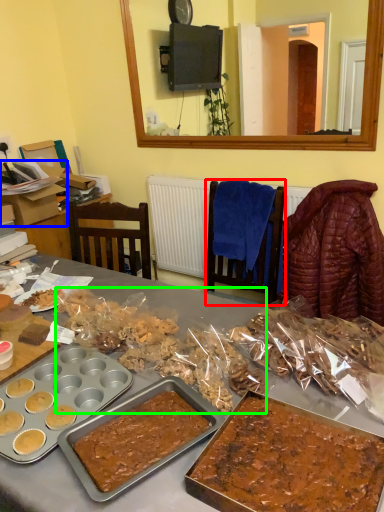
Question: Estimate the real-world distances between objects in this image. Which object is farther from chair (highlighted by a red box), box (highlighted by a blue box) or snack (highlighted by a green box)?

Choices:
 (A) box
 (B) snack

Answer: (A)